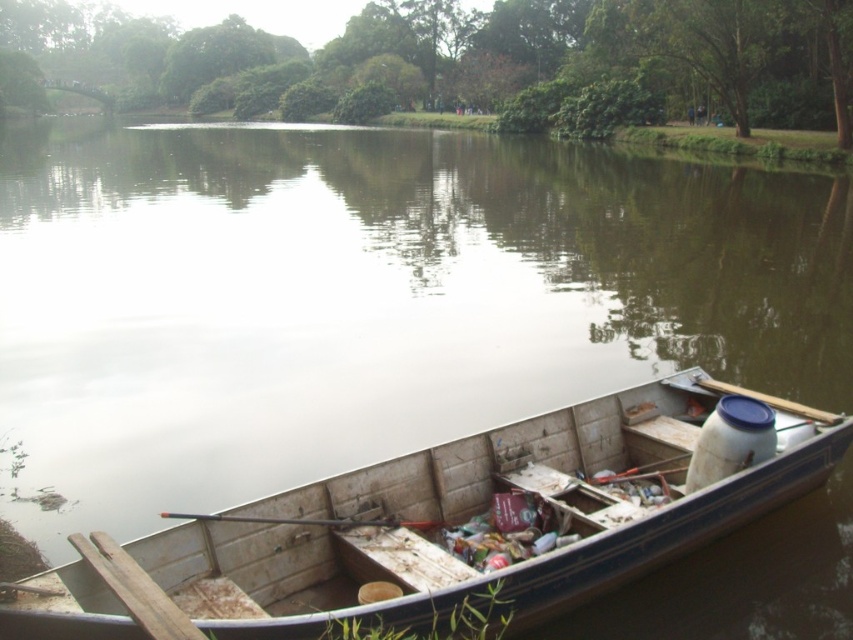
You are standing on the dock and see the point at coordinates [369,300] in the image. What is the object located at that point?

The point at coordinates [369,300] corresponds to the brown wooden river at center.

What is the 2D coordinate of the brown wooden river at center?

The brown wooden river at center is located at the 2D coordinate point of (x=369, y=300).

You are standing on the shore of the lake and see the brown wooden river at center and the wooden boat at lower right. Which object is closer to your left side?

The brown wooden river at center is to the left of the wooden boat at lower right, so it is closer to your left side.